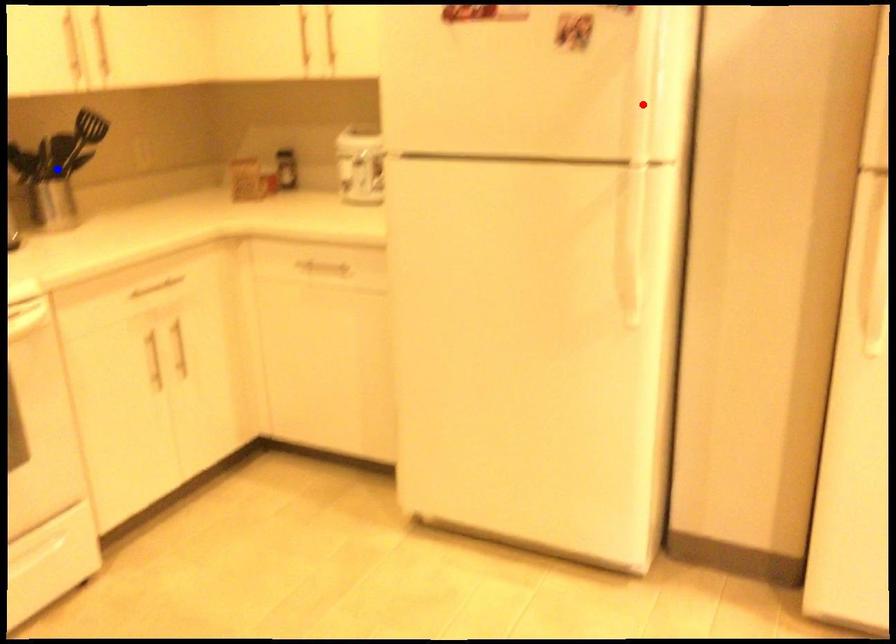
Question: Which of the two points in the image is closer to the camera?

Choices:
 (A) Blue point is closer.
 (B) Red point is closer.

Answer: (B)